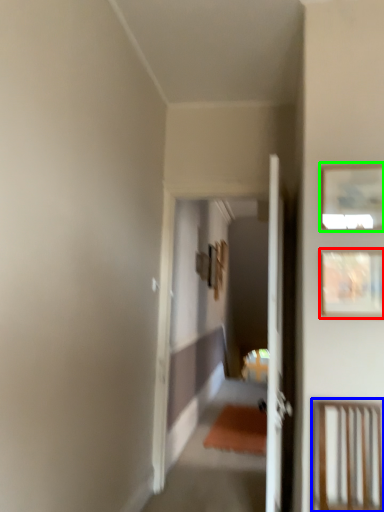
Question: Estimate the real-world distances between objects in this image. Which object is closer to picture frame (highlighted by a red box), furniture (highlighted by a blue box) or picture frame (highlighted by a green box)?

Choices:
 (A) furniture
 (B) picture frame

Answer: (B)